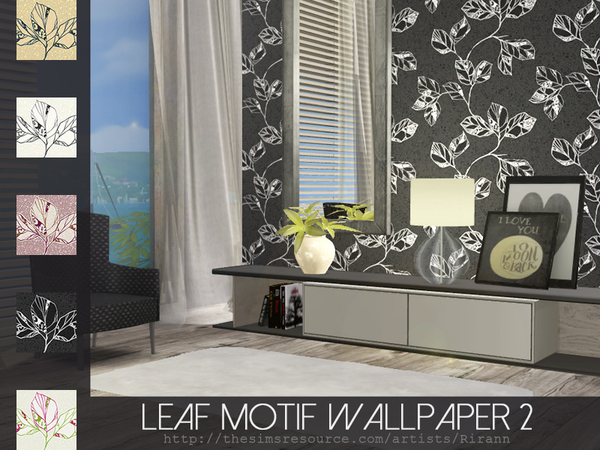
Locate an element on the screen. frame is located at coordinates (537, 177), (505, 216).